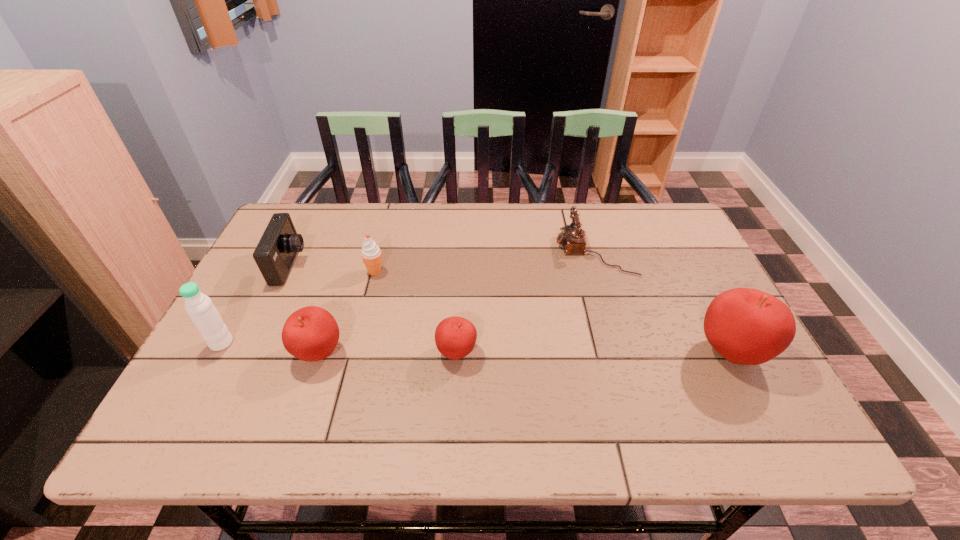
If equal spacing is the goal by inserting an additional apple among them, please point out a vacant space for this new apple. Please provide its 2D coordinates. Your answer should be formatted as a tuple, i.e. [(x, y)], where the tuple contains the x and y coordinates of a point satisfying the conditions above.

[(593, 352)]